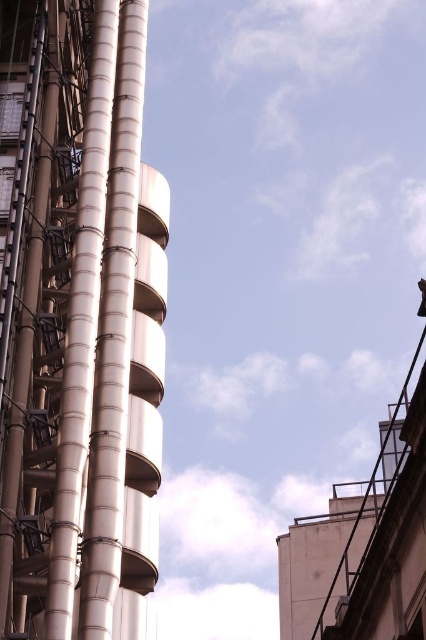
You are a maintenance worker needing to inspect both the polished silver tower at left and the metallic silver pipes at center. Given that your ladder is 4 meters long, can you safely reach both objects without moving the ladder?

The distance between the polished silver tower at left and the metallic silver pipes at center is 4.53 meters. Since the ladder is only 4 meters long, it is not long enough to cover the 4.53 meters between them. Therefore, you would need to move the ladder to reach both objects safely.

Based on the photo, you are an architect examining the building structure. You need to determine the relative positions of the polished silver tower at left and the metallic silver pipes at center. Which object is positioned to the left of the other?

The polished silver tower at left is positioned to the left of the metallic silver pipes at center.